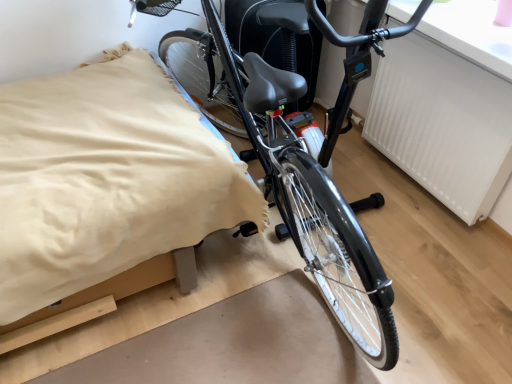
Question: Is white textured radiator at upper right bigger or smaller than beige fabric bed at center?

Choices:
 (A) small
 (B) big

Answer: (A)

Question: In terms of height, does white textured radiator at upper right look taller or shorter compared to beige fabric bed at center?

Choices:
 (A) tall
 (B) short

Answer: (A)

Question: Which object is positioned farthest from the beige fabric bed at center?

Choices:
 (A) shiny black bicycle at center
 (B) white textured radiator at upper right

Answer: (B)

Question: Estimate the real-world distances between objects in this image. Which object is closer to the beige fabric bed at center?

Choices:
 (A) shiny black bicycle at center
 (B) white textured radiator at upper right

Answer: (A)